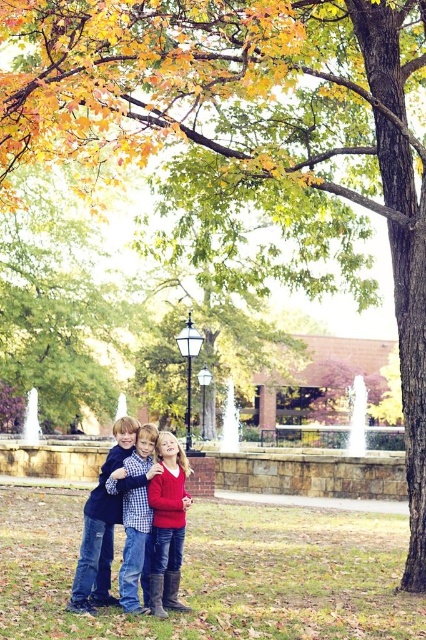
Which of these two, matte red sweater at center or checkered fabric shirt at center, stands shorter?

matte red sweater at center is shorter.

Does matte red sweater at center appear over checkered fabric shirt at center?

Yes, matte red sweater at center is above checkered fabric shirt at center.

Measure the distance between point (181, 520) and camera.

Point (181, 520) and camera are 9.26 meters apart from each other.

Locate an element on the screen. matte red sweater at center is located at coordinates (167, 524).

Which is above, denim jeans at center or matte red sweater at center?

matte red sweater at center is above.

Does denim jeans at center have a larger size compared to matte red sweater at center?

Yes, denim jeans at center is bigger than matte red sweater at center.

You are a GUI agent. You are given a task and a screenshot of the screen. Output one action in this format:
    pyautogui.click(x=<x>, y=<y>)
    Task: Click on the denim jeans at center
    The image size is (426, 640).
    Given the screenshot: What is the action you would take?
    pyautogui.click(x=100, y=529)

Locate an element on the screen. denim jeans at center is located at coordinates (100, 529).

Consider the image. Which is more to the left, denim jeans at center or checkered fabric shirt at center?

denim jeans at center is more to the left.

Is point (97, 518) positioned after point (126, 602)?

Yes.

The height and width of the screenshot is (640, 426). Find the location of `denim jeans at center`. denim jeans at center is located at coordinates (100, 529).